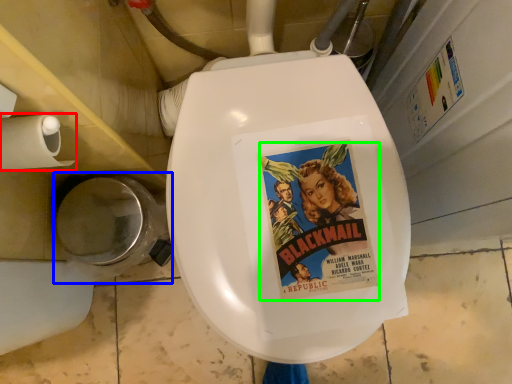
Question: Which object is positioned closest to toilet paper (highlighted by a red box)? Select from toilet bowl (highlighted by a blue box) and comic book character (highlighted by a green box).

Choices:
 (A) toilet bowl
 (B) comic book character

Answer: (A)